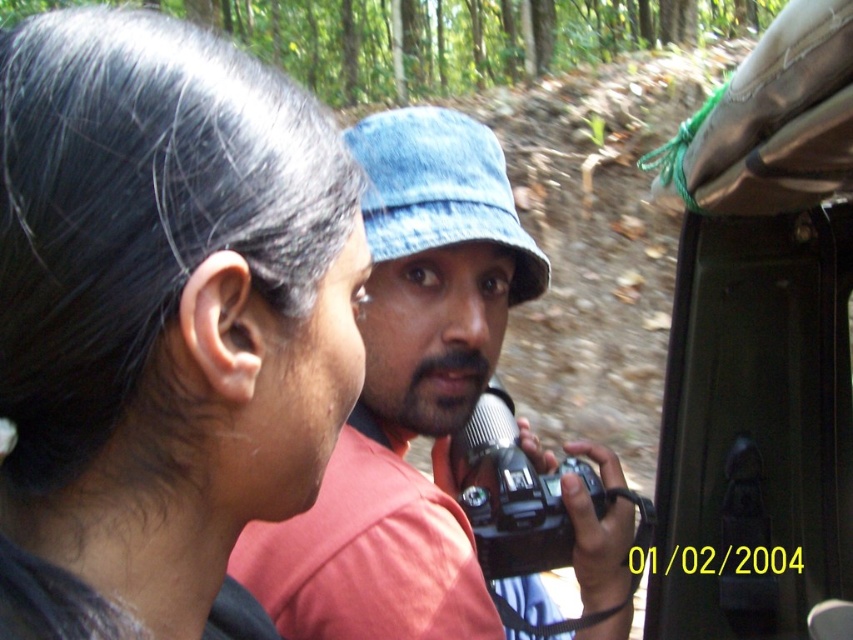
Question: Which object appears farthest from the camera in this image?

Choices:
 (A) metallic silver vehicle at right
 (B) denim hat at center
 (C) black plastic camera at center

Answer: (C)

Question: Which point is closer to the camera?

Choices:
 (A) denim blue hat at center
 (B) black plastic camera at center
 (C) denim hat at center
 (D) metallic silver vehicle at right

Answer: (D)

Question: In this image, where is black hair at upper left located relative to black plastic camera at center?

Choices:
 (A) below
 (B) above

Answer: (B)

Question: Which point is farther from the camera taking this photo?

Choices:
 (A) (73, 92)
 (B) (418, 292)

Answer: (B)

Question: Can you confirm if denim hat at center is positioned to the right of black plastic camera at center?

Choices:
 (A) no
 (B) yes

Answer: (A)

Question: From the image, what is the correct spatial relationship of denim blue hat at center in relation to black plastic camera at center?

Choices:
 (A) below
 (B) above

Answer: (B)